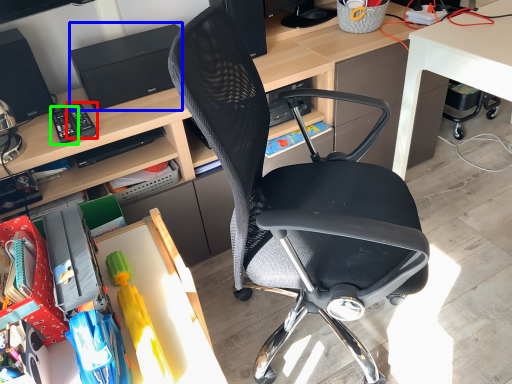
Question: Considering the real-world distances, which object is closest to remote control (highlighted by a red box)? printer (highlighted by a blue box) or remote control (highlighted by a green box).

Choices:
 (A) printer
 (B) remote control

Answer: (B)